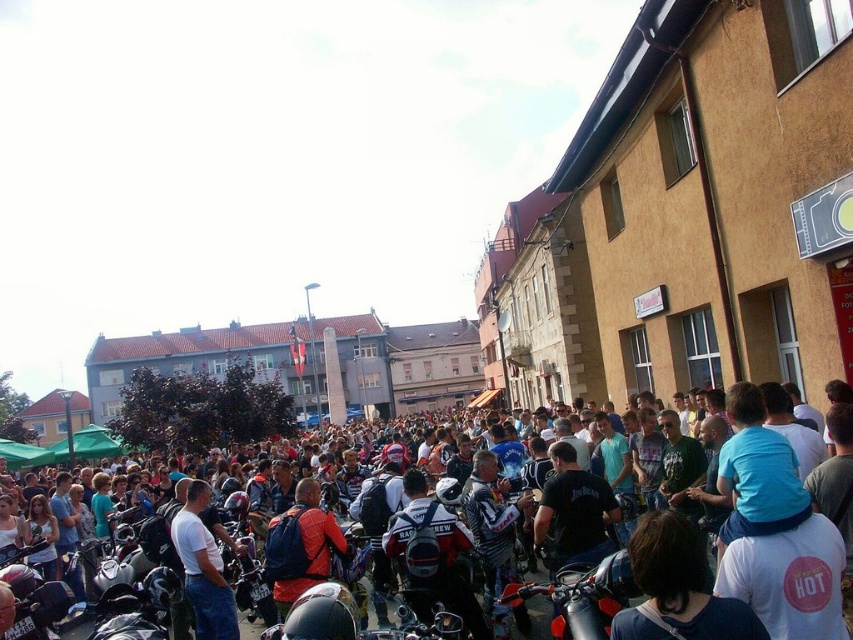
Who is more distant from viewer, (444, 547) or (604, 513)?

Positioned behind is point (604, 513).

Which is more to the right, red and white motorcycle at center or black leather jacket at center?

Positioned to the right is black leather jacket at center.

Is point (422, 582) positioned before point (547, 531)?

Yes, point (422, 582) is in front of point (547, 531).

Locate an element on the screen. The height and width of the screenshot is (640, 853). red and white motorcycle at center is located at coordinates (432, 556).

Is dark blue leather jackets at center to the right of orange fabric jacket at center from the viewer's perspective?

Indeed, dark blue leather jackets at center is positioned on the right side of orange fabric jacket at center.

What do you see at coordinates (727, 580) in the screenshot? I see `dark blue leather jackets at center` at bounding box center [727, 580].

Between point (813, 636) and point (316, 573), which one is positioned behind?

The point (316, 573) is behind.

The height and width of the screenshot is (640, 853). I want to click on dark blue leather jackets at center, so click(727, 580).

Can you confirm if red and white motorcycle at center is thinner than white matte t-shirt at center?

Incorrect, red and white motorcycle at center's width is not less than white matte t-shirt at center's.

Is red and white motorcycle at center to the left of white matte t-shirt at center from the viewer's perspective?

Incorrect, red and white motorcycle at center is not on the left side of white matte t-shirt at center.

Locate an element on the screen. The width and height of the screenshot is (853, 640). red and white motorcycle at center is located at coordinates (432, 556).